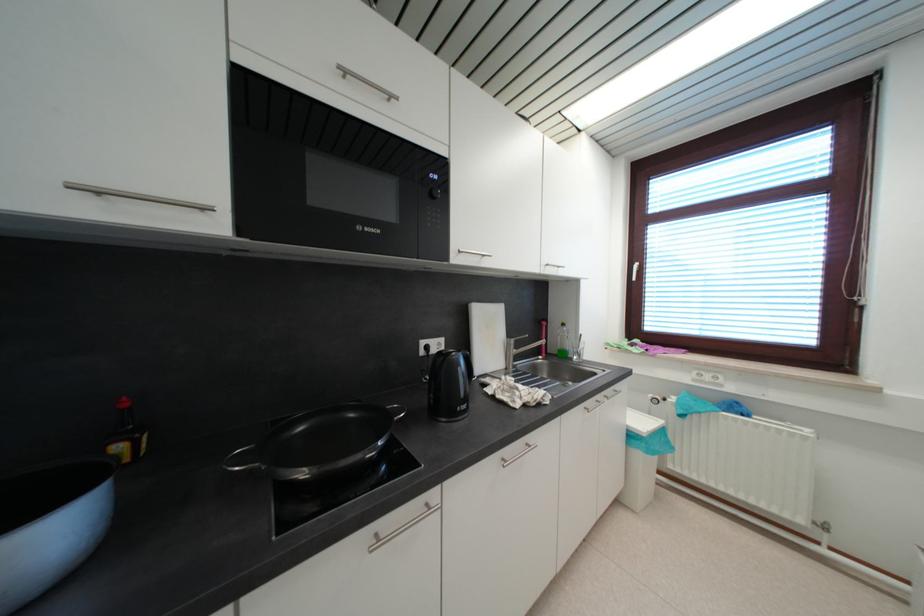
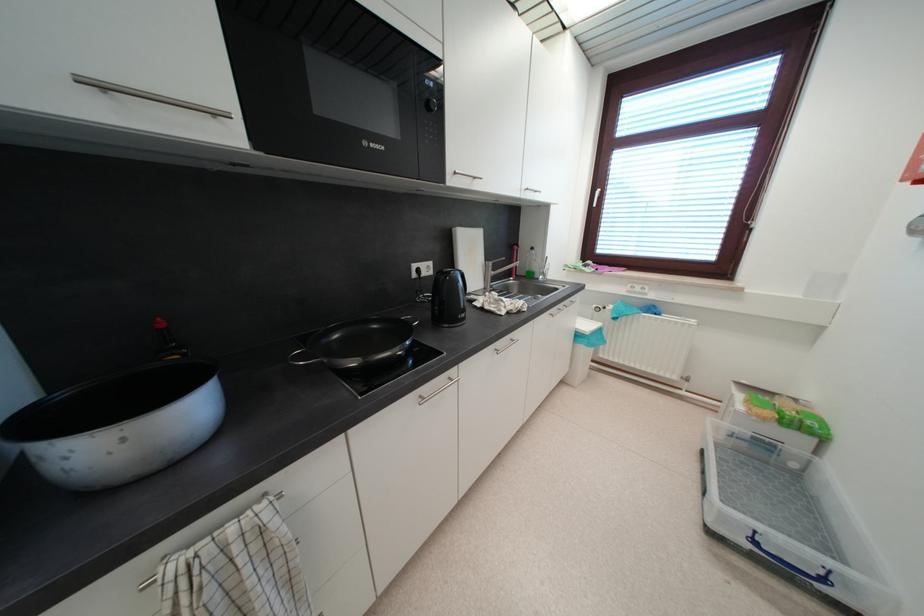
In the second image, find the point that corresponds to [438,198] in the first image.

(433, 108)